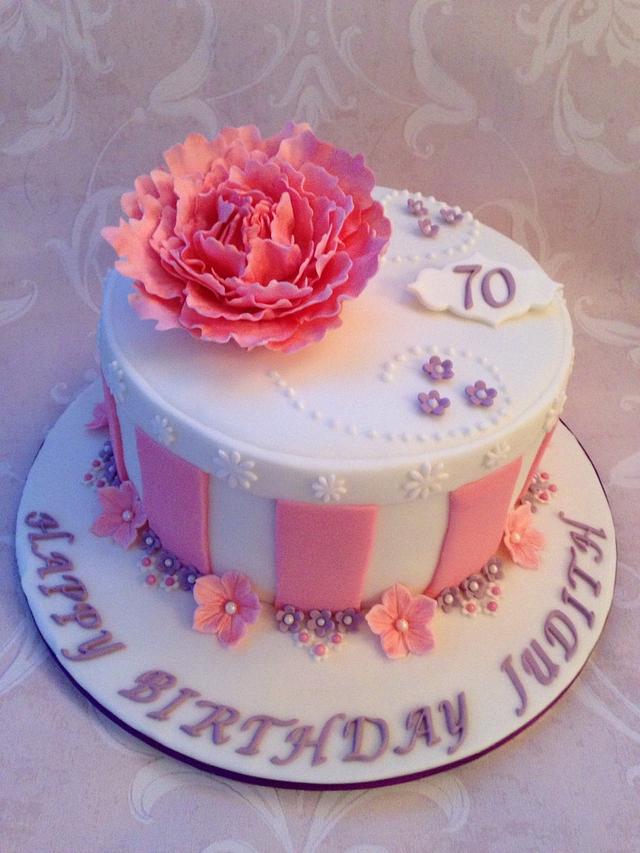
You are a GUI agent. You are given a task and a screenshot of the screen. Output one action in this format:
    pyautogui.click(x=<x>, y=<y>)
    Task: Click on the lace tablecloth
    The height and width of the screenshot is (853, 640).
    Given the screenshot: What is the action you would take?
    pyautogui.click(x=543, y=784), pyautogui.click(x=80, y=784), pyautogui.click(x=52, y=206), pyautogui.click(x=575, y=183)